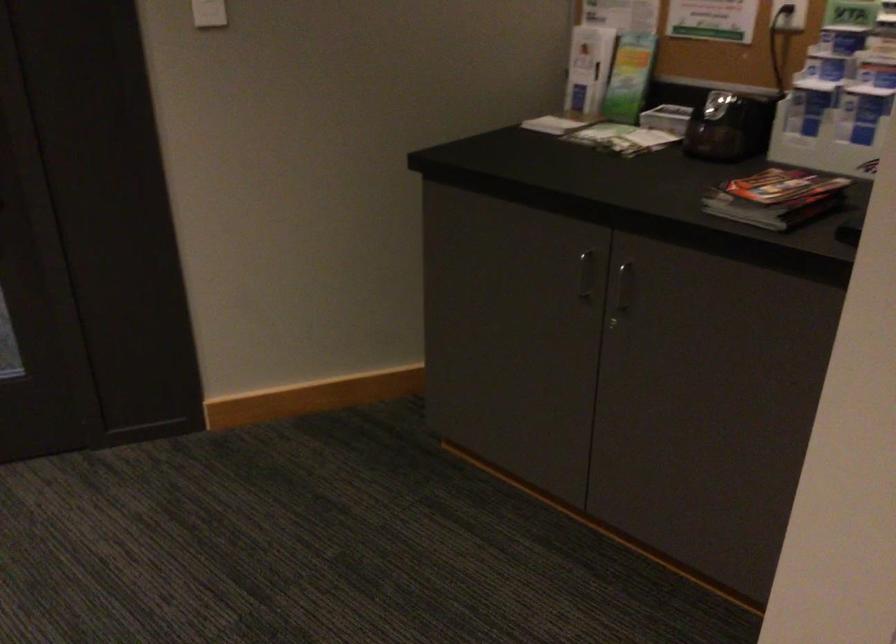
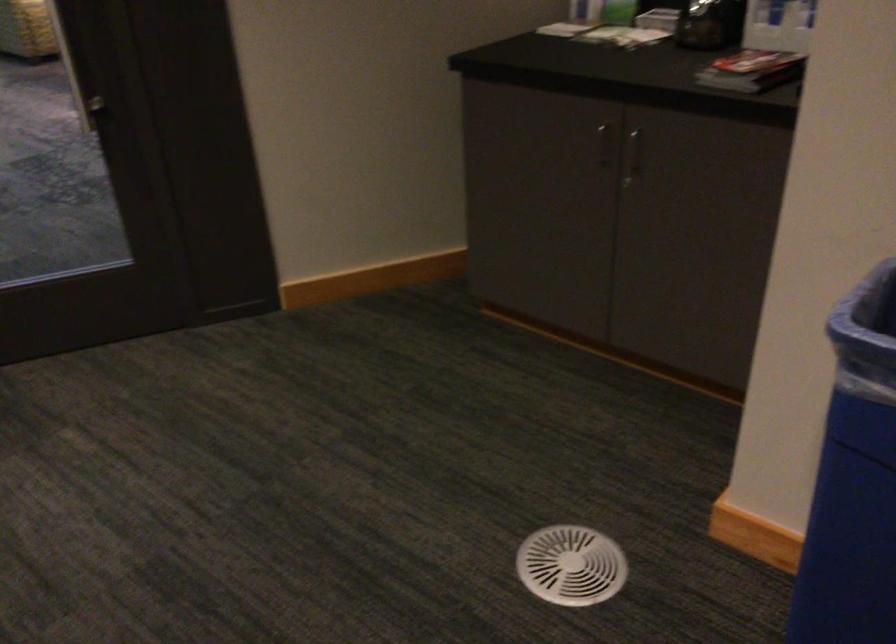
Where in the second image is the point corresponding to point (623, 295) from the first image?

(633, 155)